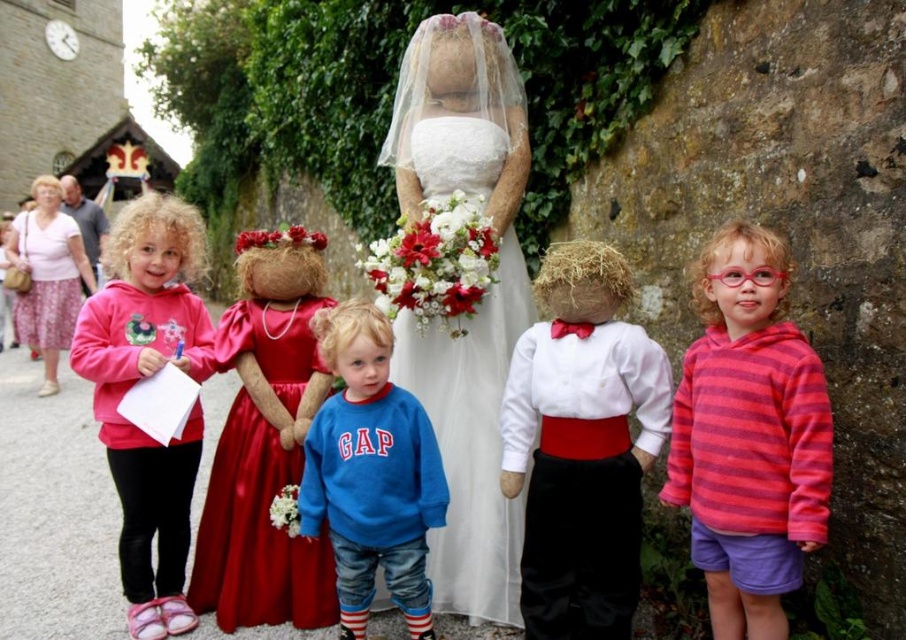
Question: Which of the following is the closest to the observer?

Choices:
 (A) (27, 260)
 (B) (707, 376)
 (C) (150, 579)
 (D) (576, 481)

Answer: (B)

Question: Is white satin dress at center bigger than pink floral-patterned dress at left?

Choices:
 (A) no
 (B) yes

Answer: (A)

Question: Is pink fleece hoodie at center to the right of pink floral-patterned dress at left from the viewer's perspective?

Choices:
 (A) yes
 (B) no

Answer: (B)

Question: Which of the following is the closest to the observer?

Choices:
 (A) (442, 49)
 (B) (717, 576)
 (C) (148, 628)
 (D) (268, 352)

Answer: (B)

Question: Where is white satin dress at center located in relation to pink floral-patterned dress at left in the image?

Choices:
 (A) left
 (B) right

Answer: (B)

Question: Which point appears farthest from the camera in this image?

Choices:
 (A) (436, 381)
 (B) (664, 428)

Answer: (A)